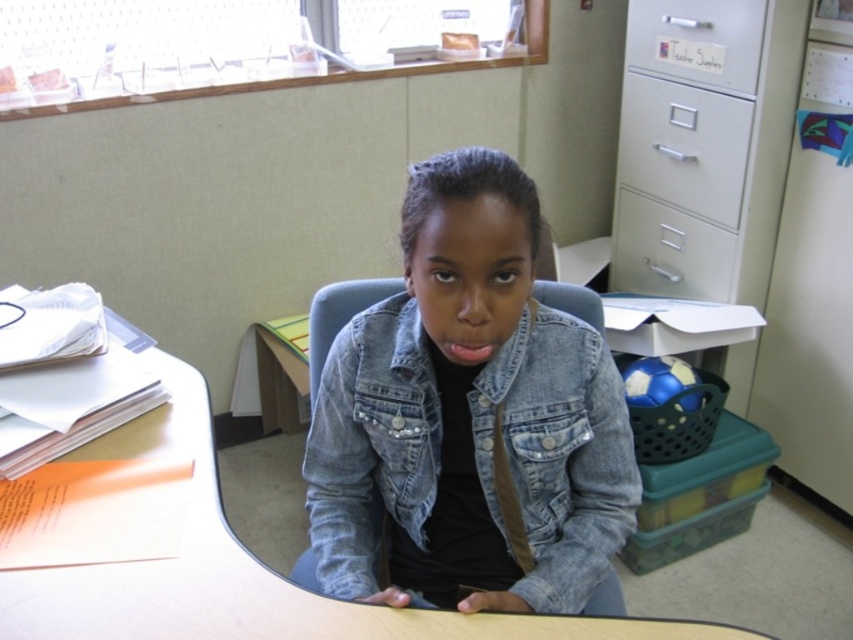
You are an office assistant who needs to place a 6.2 inch wide box between the white matte file cabinet at upper right and the white plastic drawer at upper right. Can you fit the box in the space between them?

The space between the white matte file cabinet at upper right and the white plastic drawer at upper right is only 5.80 inches, which is narrower than the 6.2 inch wide box. Therefore, the box cannot fit in that space.

You are a teacher who needs to reach the white metal file cabinet at upper right from your current position near the denim jacket at center. Can you comfortably reach it without moving your chair?

The distance between the denim jacket at center and the white metal file cabinet at upper right is 3.74 feet. Since this distance is greater than the typical arm reach of an average person, you would need to move your chair closer to comfortably access the cabinet.